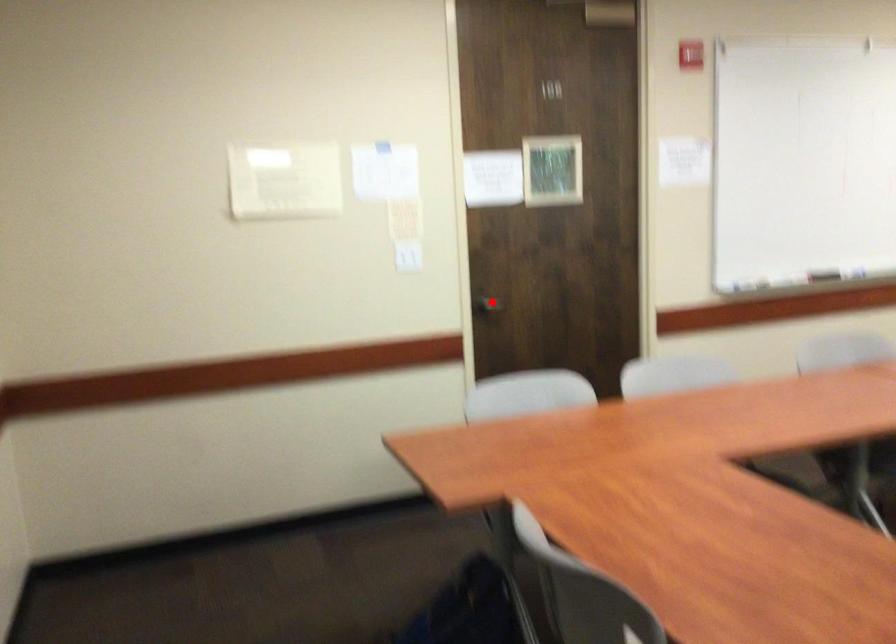
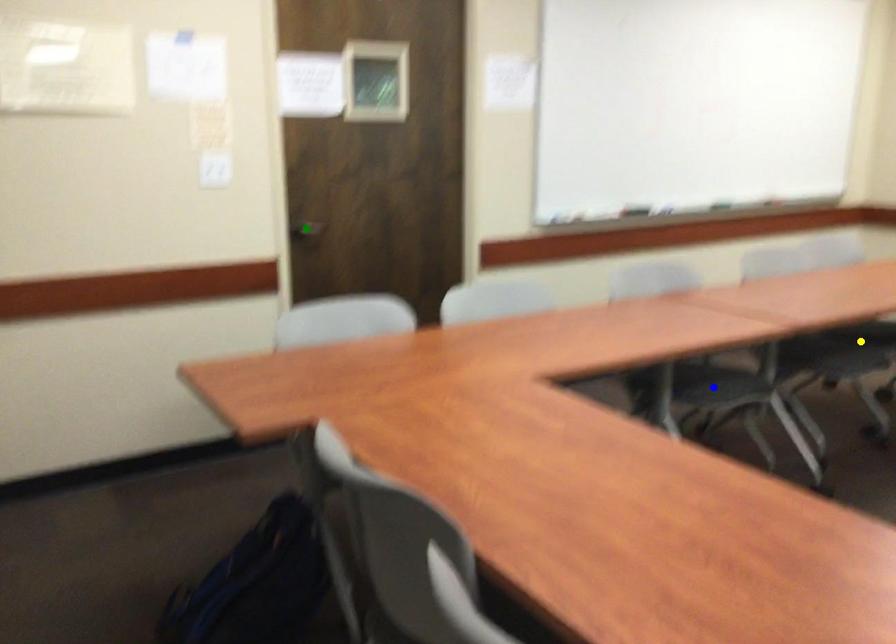
Question: I am providing you with two images of the same scene from different viewpoints. A red point is marked on the first image. You are given multiple points on the second image. Which point in image 2 is actually the same real-world point as the red point in image 1?

Choices:
 (A) blue point
 (B) green point
 (C) yellow point

Answer: (B)